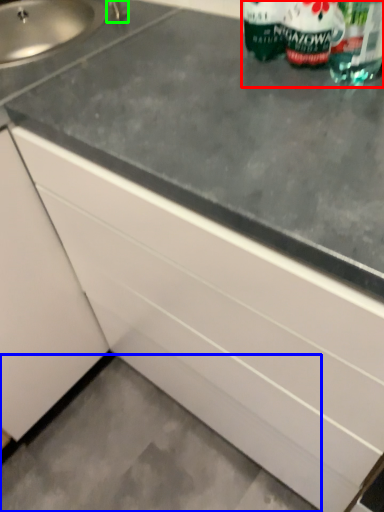
Question: Based on their relative distances, which object is farther from bottle (highlighted by a red box)? Choose from concrete (highlighted by a blue box) and faucet (highlighted by a green box).

Choices:
 (A) concrete
 (B) faucet

Answer: (A)